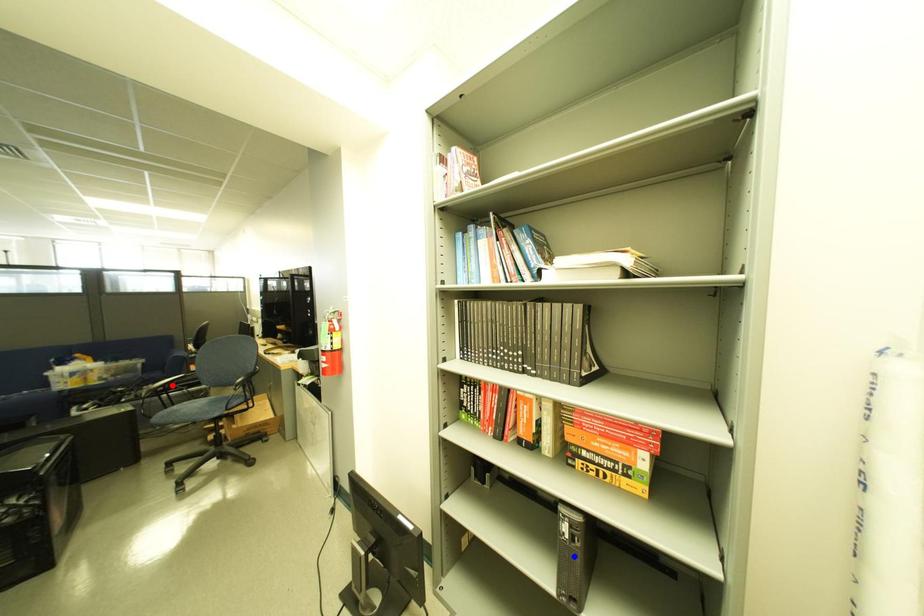
Question: In the image, two points are highlighted. Which point is nearer to the camera? Reply with the corresponding letter.

Choices:
 (A) blue point
 (B) red point

Answer: (A)